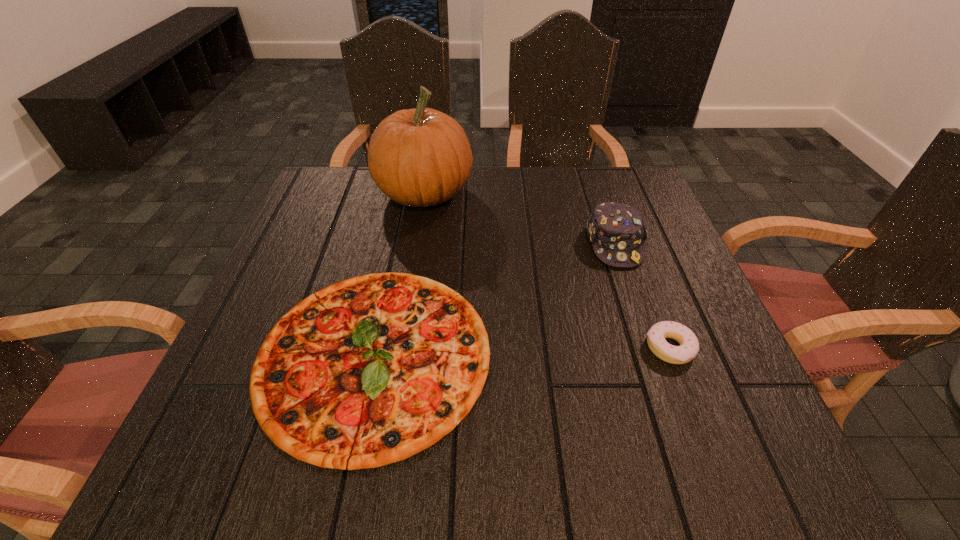
Where is `free space at the near right corner of the desktop`? The image size is (960, 540). free space at the near right corner of the desktop is located at coordinates (702, 448).

Find the location of a particular element. Image resolution: width=960 pixels, height=540 pixels. vacant region between the doughnut and the second tallest object is located at coordinates (642, 296).

Identify the location of vacant space that is in between the second tallest object and the shortest object. This screenshot has height=540, width=960. (494, 299).

You are a GUI agent. You are given a task and a screenshot of the screen. Output one action in this format:
    pyautogui.click(x=<x>, y=<y>)
    Task: Click on the free space between the third tallest object and the tallest object
    The width and height of the screenshot is (960, 540).
    Given the screenshot: What is the action you would take?
    pyautogui.click(x=547, y=271)

Where is `vacant region between the third tallest object and the pumpkin`? vacant region between the third tallest object and the pumpkin is located at coordinates (547, 271).

This screenshot has width=960, height=540. Find the location of `empty space that is in between the pumpkin and the second tallest object`. empty space that is in between the pumpkin and the second tallest object is located at coordinates (519, 219).

Locate an element on the screen. vacant area between the headwear and the shortest object is located at coordinates (494, 299).

Where is `vacant space in between the headwear and the pizza`? The width and height of the screenshot is (960, 540). vacant space in between the headwear and the pizza is located at coordinates (494, 299).

Identify the location of vacant space in between the third tallest object and the second tallest object. The width and height of the screenshot is (960, 540). (642, 296).

Find the location of a particular element. The height and width of the screenshot is (540, 960). object that stands as the third closest to the pizza is located at coordinates (689, 346).